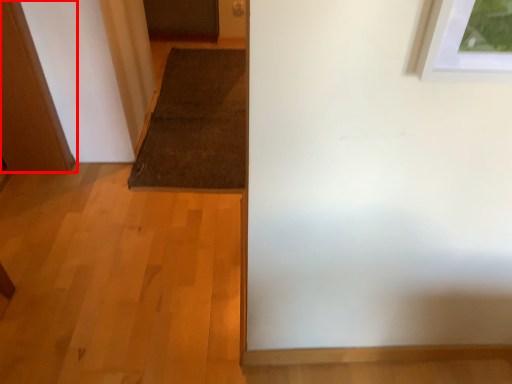
Question: From the image's perspective, where is door (annotated by the red box) located in relation to doormat in the image?

Choices:
 (A) above
 (B) below

Answer: (B)